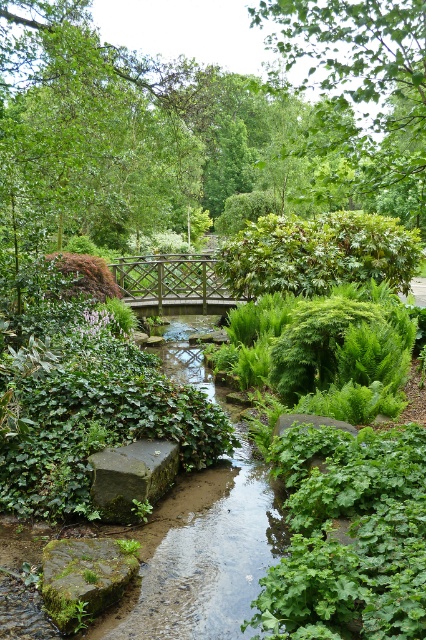
You are a hiker who wants to cross the wooden lattice bridge at center. However, there is a green leafy tree at upper center blocking your path. Can you walk under the tree to reach the bridge?

The green leafy tree at upper center is positioned over the wooden lattice bridge at center, so yes, you can walk under the tree to reach the bridge.

You are a painter setting up your easel in the garden scene. You want to capture the green leafy tree at upper center and the gray stone at center in your painting. Which object should you focus on if you want to paint the wider one?

The green leafy tree at upper center is wider than the gray stone at center, so you should focus on the green leafy tree at upper center for a wider subject.

You are standing in the garden and see the green mossy rock at lower left. If you want to place a 3 meter long wooden bench in front of it, will the bench fit without overlapping the rock?

The distance between you and the green mossy rock at lower left is 2.73 meters. Since the bench is 3 meters long, placing it in front of the rock would require more space than available, so it won